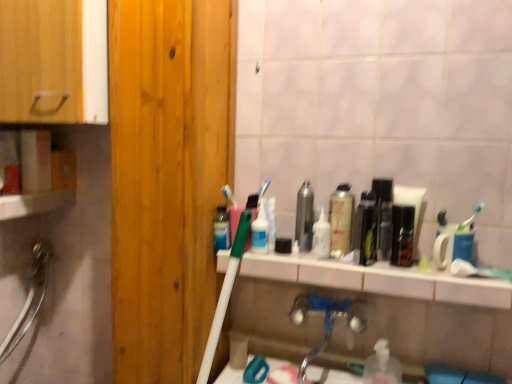
Image resolution: width=512 pixels, height=384 pixels. Find the location of `free spot above white glossy counter top at center (from a real-world perspective)`. free spot above white glossy counter top at center (from a real-world perspective) is located at coordinates (390, 266).